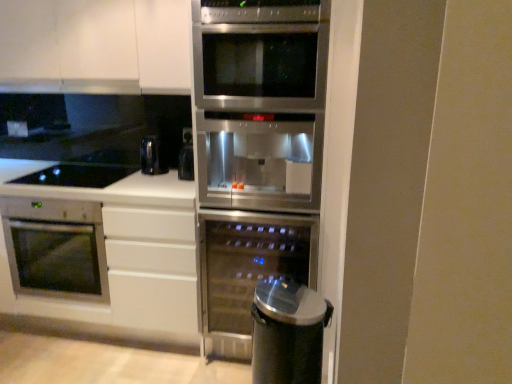
You are a GUI agent. You are given a task and a screenshot of the screen. Output one action in this format:
    pyautogui.click(x=<x>, y=<y>)
    Task: Click on the stainless steel fridge at center
    
    Given the screenshot: What is the action you would take?
    pyautogui.click(x=256, y=154)

The width and height of the screenshot is (512, 384). What do you see at coordinates (95, 46) in the screenshot? I see `white matte cabinet at upper left` at bounding box center [95, 46].

In order to face satin silver oven at lower left, which is the 2th oven in right-to-left order, should I rotate leftwards or rightwards?

You should look left and rotate roughly 22.290 degrees.

Locate an element on the screen. This screenshot has width=512, height=384. white matte countertop at lower left is located at coordinates (110, 258).

From the image's perspective, relative to satin silver oven at lower left, arranged as the first oven when viewed from the left, is black glass cooktop at lower left above or below?

black glass cooktop at lower left is situated higher than satin silver oven at lower left, arranged as the first oven when viewed from the left, in the image.

Based on their sizes in the image, would you say black glass cooktop at lower left is bigger or smaller than satin silver oven at lower left, which is the 2th oven in right-to-left order?

Considering their sizes, black glass cooktop at lower left takes up less space than satin silver oven at lower left, which is the 2th oven in right-to-left order.

In terms of width, does black glass cooktop at lower left look wider or thinner when compared to satin silver oven at lower left, arranged as the first oven when viewed from the left?

black glass cooktop at lower left is thinner than satin silver oven at lower left, arranged as the first oven when viewed from the left.

Would you consider black glass cooktop at lower left to be distant from satin silver oven at lower left, arranged as the first oven when viewed from the left?

No, there isn't a large distance between black glass cooktop at lower left and satin silver oven at lower left, arranged as the first oven when viewed from the left.

Do you think stainless steel fridge at center is within satin silver exhaust hood at upper center, or outside of it?

The correct answer is: outside.

Is stainless steel fridge at center facing towards satin silver exhaust hood at upper center?

No, stainless steel fridge at center does not turn towards satin silver exhaust hood at upper center.

Can you confirm if stainless steel fridge at center is shorter than satin silver exhaust hood at upper center?

In fact, stainless steel fridge at center may be taller than satin silver exhaust hood at upper center.

Does stainless steel fridge at center appear on the right side of satin silver exhaust hood at upper center?

Yes, stainless steel fridge at center is to the right of satin silver exhaust hood at upper center.

In the scene shown: How much distance is there between satin silver oven at lower left, arranged as the first oven when viewed from the left, and black glass cooktop at lower left?

They are 19.51 inches apart.

Which is behind, point (46, 279) or point (28, 176)?

The point (28, 176) is farther from the camera.

Do you think satin silver oven at lower left, arranged as the first oven when viewed from the left, is within black glass cooktop at lower left, or outside of it?

satin silver oven at lower left, arranged as the first oven when viewed from the left, is not inside black glass cooktop at lower left, it's outside.

Is satin silver oven at lower left, which is the 2th oven in right-to-left order, positioned before black glass cooktop at lower left?

Yes, satin silver oven at lower left, which is the 2th oven in right-to-left order, is closer to the viewer.

In the scene shown: Can we say sleek metallic trash can at lower right lies outside stainless steel fridge at center?

Yes, sleek metallic trash can at lower right is not within stainless steel fridge at center.

From the image's perspective, between sleek metallic trash can at lower right and stainless steel fridge at center, which one is located above?

stainless steel fridge at center.

From the picture: Which of these two, sleek metallic trash can at lower right or stainless steel fridge at center, is bigger?

stainless steel fridge at center is bigger.

Is black glass cooktop at lower left smaller than stainless steel fridge at center?

Indeed, black glass cooktop at lower left has a smaller size compared to stainless steel fridge at center.

Does point (89, 176) lie in front of point (255, 66)?

That is False.

From the image's perspective, is black glass cooktop at lower left located above or below stainless steel fridge at center?

Based on their image positions, black glass cooktop at lower left is located above stainless steel fridge at center.

In the scene shown: Which is correct: satin silver exhaust hood at upper center is inside white matte cabinet at upper left, or outside of it?

satin silver exhaust hood at upper center is inside white matte cabinet at upper left.

Considering the sizes of objects satin silver exhaust hood at upper center and white matte cabinet at upper left in the image provided, who is shorter, satin silver exhaust hood at upper center or white matte cabinet at upper left?

Standing shorter between the two is satin silver exhaust hood at upper center.

Can you tell me how much sleek metallic trash can at lower right and black glass cooktop at lower left differ in facing direction?

There is a 0.00263-degree angle between the facing directions of sleek metallic trash can at lower right and black glass cooktop at lower left.

From the image's perspective, which is above, sleek metallic trash can at lower right or black glass cooktop at lower left?

black glass cooktop at lower left appears higher in the image.

From the picture: Considering the relative sizes of sleek metallic trash can at lower right and black glass cooktop at lower left in the image provided, is sleek metallic trash can at lower right thinner than black glass cooktop at lower left?

Correct, the width of sleek metallic trash can at lower right is less than that of black glass cooktop at lower left.

Would you say sleek metallic trash can at lower right is inside or outside black glass cooktop at lower left?

sleek metallic trash can at lower right is spatially situated outside black glass cooktop at lower left.

There is a satin silver oven at lower left, which is the 2th oven in right-to-left order. Find the location of `gas stove above it (from a real-world perspective)`. gas stove above it (from a real-world perspective) is located at coordinates (77, 175).

Locate an element on the screen. This screenshot has height=384, width=512. fridge in front of the satin silver exhaust hood at upper center is located at coordinates coord(256,154).

Estimate the real-world distances between objects in this image. Which object is closer to satin stainless steel wine cooler at center, the first oven positioned from the right, satin silver exhaust hood at upper center or satin silver oven at lower left, arranged as the first oven when viewed from the left?

satin silver oven at lower left, arranged as the first oven when viewed from the left, is closer to satin stainless steel wine cooler at center, the first oven positioned from the right.

Estimate the real-world distances between objects in this image. Which object is further from satin silver oven at lower left, arranged as the first oven when viewed from the left, white matte countertop at lower left or satin silver exhaust hood at upper center?

satin silver exhaust hood at upper center lies further to satin silver oven at lower left, arranged as the first oven when viewed from the left, than the other object.

Considering their positions, is black glass cooktop at lower left positioned closer to satin silver oven at lower left, which is the 2th oven in right-to-left order, than white matte cabinet at upper left?

black glass cooktop at lower left is closer to satin silver oven at lower left, which is the 2th oven in right-to-left order.

Which object lies nearer to the anchor point white matte countertop at lower left, satin silver exhaust hood at upper center or white matte cabinet at upper left?

Based on the image, white matte cabinet at upper left appears to be nearer to white matte countertop at lower left.

Looking at the image, which one is located further to white matte countertop at lower left, satin stainless steel wine cooler at center, the 2th oven from the left, or black glass cooktop at lower left?

black glass cooktop at lower left is further to white matte countertop at lower left.

Which object lies nearer to the anchor point satin silver oven at lower left, which is the 2th oven in right-to-left order, satin stainless steel wine cooler at center, the 2th oven from the left, or black glass cooktop at lower left?

The object closer to satin silver oven at lower left, which is the 2th oven in right-to-left order, is black glass cooktop at lower left.

Based on their spatial positions, is white matte countertop at lower left or white matte cabinet at upper left further from black glass cooktop at lower left?

white matte cabinet at upper left.

From the picture: Looking at the image, which one is located further to stainless steel fridge at center, satin stainless steel wine cooler at center, the first oven positioned from the right, or white matte cabinet at upper left?

white matte cabinet at upper left is further to stainless steel fridge at center.

Image resolution: width=512 pixels, height=384 pixels. Find the location of `fridge located between white matte countertop at lower left and sleek metallic trash can at lower right in the left-right direction`. fridge located between white matte countertop at lower left and sleek metallic trash can at lower right in the left-right direction is located at coordinates (256, 154).

This screenshot has height=384, width=512. Find the location of `fridge situated between satin silver exhaust hood at upper center and sleek metallic trash can at lower right from left to right`. fridge situated between satin silver exhaust hood at upper center and sleek metallic trash can at lower right from left to right is located at coordinates (256, 154).

Where is `cabinetry between white matte countertop at lower left and stainless steel fridge at center from left to right`? Image resolution: width=512 pixels, height=384 pixels. cabinetry between white matte countertop at lower left and stainless steel fridge at center from left to right is located at coordinates (95, 46).

The width and height of the screenshot is (512, 384). In order to click on oven between satin silver exhaust hood at upper center and white matte countertop at lower left from top to bottom in this screenshot , I will do `click(56, 248)`.